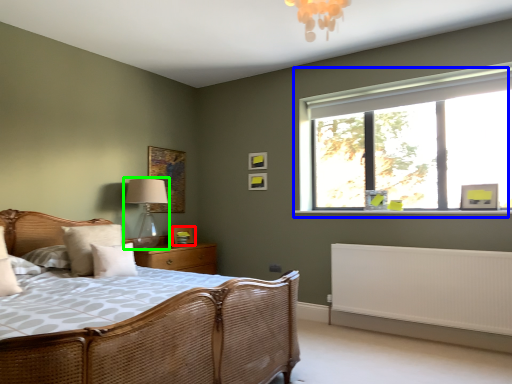
Question: Which object is positioned closest to picture frame (highlighted by a red box)? Select from window (highlighted by a blue box) and table lamp (highlighted by a green box).

Choices:
 (A) window
 (B) table lamp

Answer: (B)